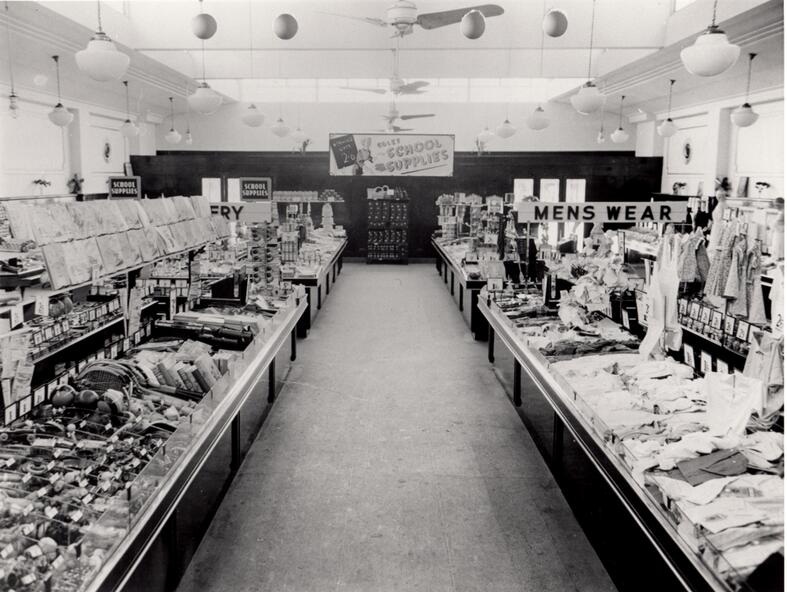
Locate an element on the screen. Image resolution: width=787 pixels, height=592 pixels. floor is located at coordinates (419, 453).